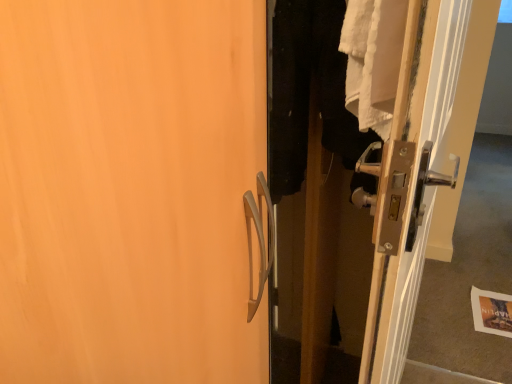
Image resolution: width=512 pixels, height=384 pixels. In order to click on metallic silver handle at right in this screenshot , I will do tap(411, 184).

What do you see at coordinates (411, 184) in the screenshot? I see `metallic silver handle at right` at bounding box center [411, 184].

The height and width of the screenshot is (384, 512). I want to click on metallic silver handle at right, so click(411, 184).